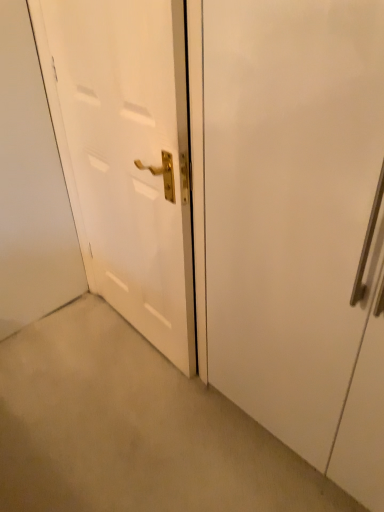
Question: In which direction should I rotate to look at white glossy door at center, arranged as the first door when viewed from the left?

Choices:
 (A) right
 (B) left

Answer: (B)

Question: From a real-world perspective, is white matte door at right, acting as the 2th door starting from the left, on white glossy door at center, the second door in the right-to-left sequence?

Choices:
 (A) yes
 (B) no

Answer: (A)

Question: Considering the relative sizes of white matte door at right, acting as the 2th door starting from the left, and white glossy door at center, the second door in the right-to-left sequence, in the image provided, is white matte door at right, acting as the 2th door starting from the left, wider than white glossy door at center, the second door in the right-to-left sequence,?

Choices:
 (A) no
 (B) yes

Answer: (B)

Question: Is white matte door at right, acting as the first door starting from the right, positioned beyond the bounds of white glossy door at center, the second door in the right-to-left sequence?

Choices:
 (A) no
 (B) yes

Answer: (B)

Question: Is white matte door at right, acting as the first door starting from the right, placed right next to white glossy door at center, arranged as the first door when viewed from the left?

Choices:
 (A) no
 (B) yes

Answer: (A)

Question: Is the depth of white matte door at right, acting as the first door starting from the right, greater than that of white glossy door at center, the second door in the right-to-left sequence?

Choices:
 (A) no
 (B) yes

Answer: (A)

Question: Does white matte door at right, acting as the first door starting from the right, have a larger size compared to white glossy door at center, the second door in the right-to-left sequence?

Choices:
 (A) no
 (B) yes

Answer: (B)

Question: Is white matte door at right, acting as the first door starting from the right, completely or partially inside white glossy door at center, the second door in the right-to-left sequence?

Choices:
 (A) no
 (B) yes

Answer: (A)

Question: Considering the relative sizes of white glossy door at center, the second door in the right-to-left sequence, and white matte door at right, acting as the first door starting from the right, in the image provided, is white glossy door at center, the second door in the right-to-left sequence, smaller than white matte door at right, acting as the first door starting from the right,?

Choices:
 (A) yes
 (B) no

Answer: (A)

Question: Could you tell me if white glossy door at center, the second door in the right-to-left sequence, is turned towards white matte door at right, acting as the first door starting from the right?

Choices:
 (A) no
 (B) yes

Answer: (A)

Question: Is white glossy door at center, arranged as the first door when viewed from the left, thinner than white matte door at right, acting as the 2th door starting from the left?

Choices:
 (A) yes
 (B) no

Answer: (A)

Question: Does white glossy door at center, the second door in the right-to-left sequence, have a greater width compared to white matte door at right, acting as the first door starting from the right?

Choices:
 (A) no
 (B) yes

Answer: (A)

Question: Would you consider white glossy door at center, arranged as the first door when viewed from the left, to be distant from white matte door at right, acting as the first door starting from the right?

Choices:
 (A) no
 (B) yes

Answer: (A)

Question: Is white matte door at right, acting as the first door starting from the right, situated inside white glossy door at center, the second door in the right-to-left sequence, or outside?

Choices:
 (A) outside
 (B) inside

Answer: (A)